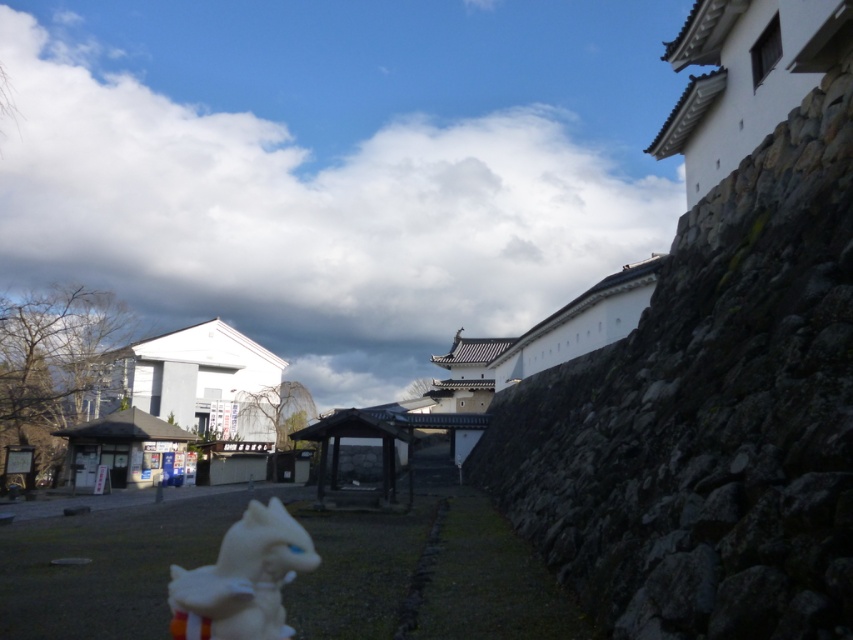
Which is below, white fluffy cloud at upper center or white plush toy at lower center?

Positioned lower is white plush toy at lower center.

What do you see at coordinates (335, 166) in the screenshot? This screenshot has height=640, width=853. I see `white fluffy cloud at upper center` at bounding box center [335, 166].

Does point (131, 36) lie behind point (296, 532)?

Yes, it is.

Where is `white fluffy cloud at upper center`? The width and height of the screenshot is (853, 640). white fluffy cloud at upper center is located at coordinates (335, 166).